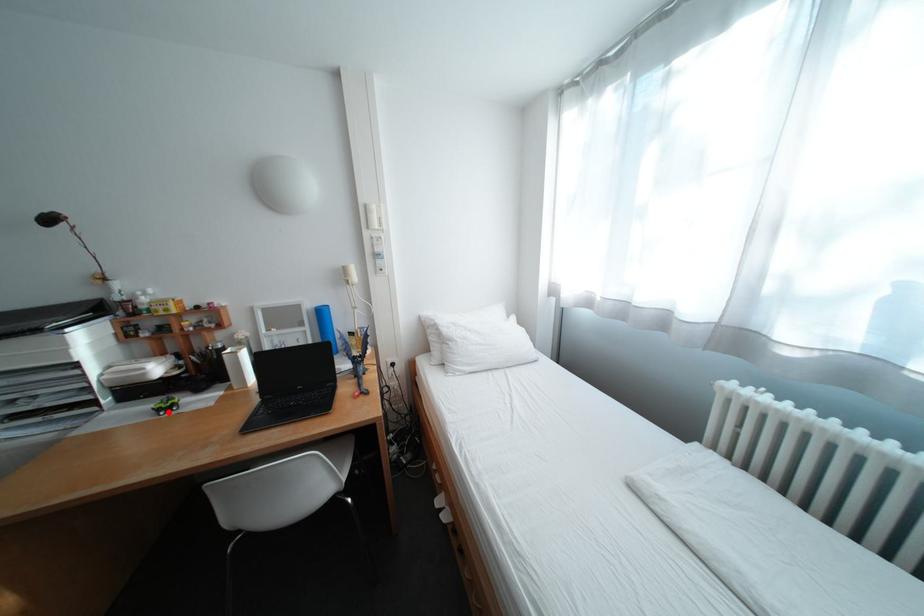
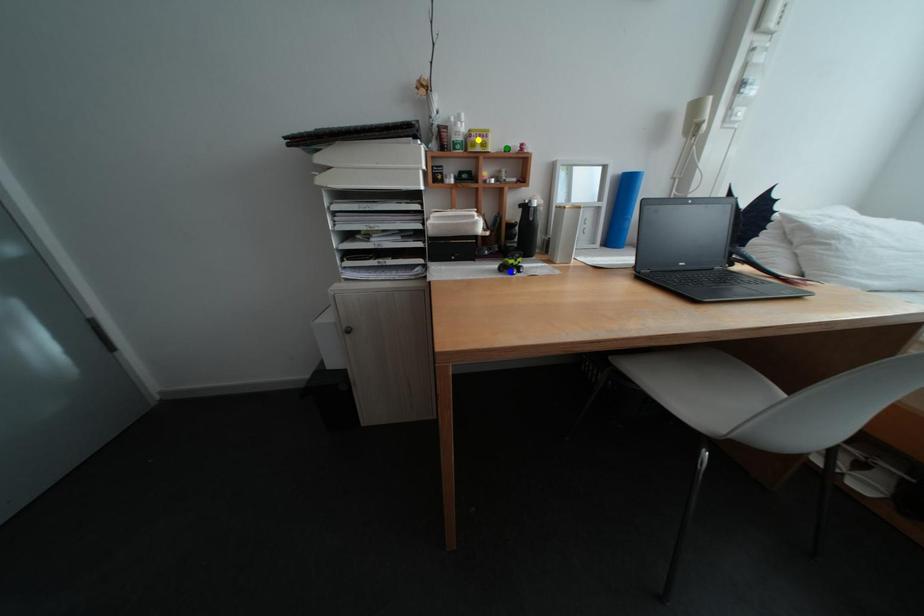
Question: I am providing you with two images of the same scene from different viewpoints. A red point is marked on the first image. You are given multiple points on the second image. Which mark in image 2 goes with the point in image 1?

Choices:
 (A) blue point
 (B) yellow point
 (C) green point

Answer: (A)